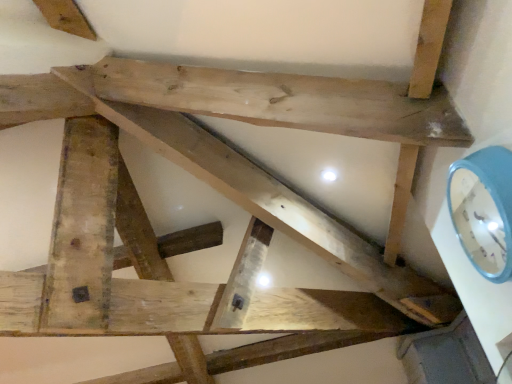
At what (x,y) coordinates should I click in order to perform the action: click on white plastic clock at right. Please return your answer as a coordinate pair (x, y). This screenshot has width=512, height=384. Looking at the image, I should click on (484, 210).

The image size is (512, 384). What do you see at coordinates (484, 210) in the screenshot?
I see `white plastic clock at right` at bounding box center [484, 210].

Identify the location of white plastic clock at right. (484, 210).